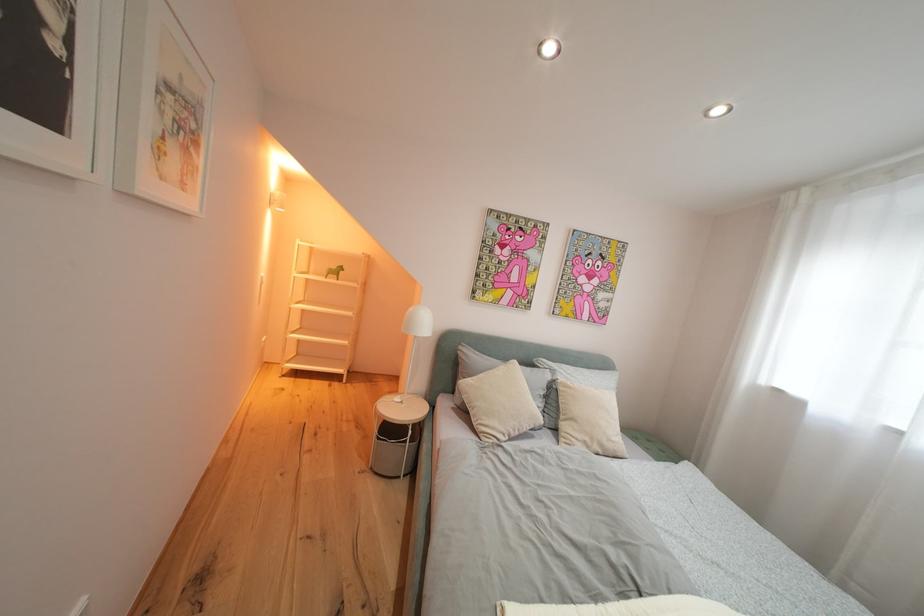
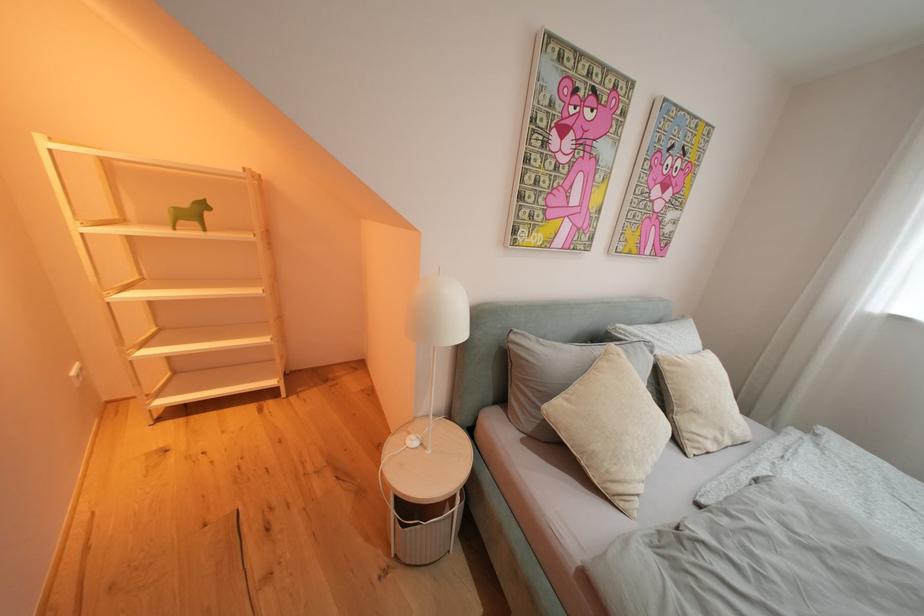
In a continuous first-person perspective shot, in which direction is the camera moving?

The cameraman moved toward left, forward.